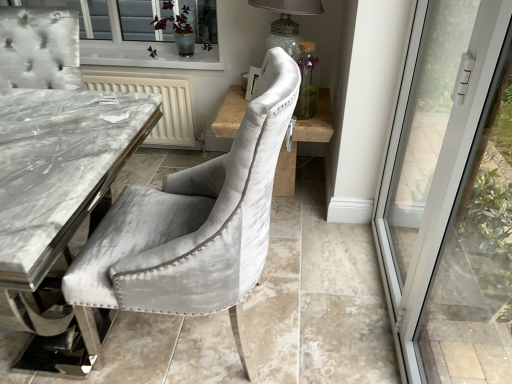
This screenshot has width=512, height=384. What are the coordinates of `vacant space to the right of velvet grey chair at center` in the screenshot? It's located at (330, 306).